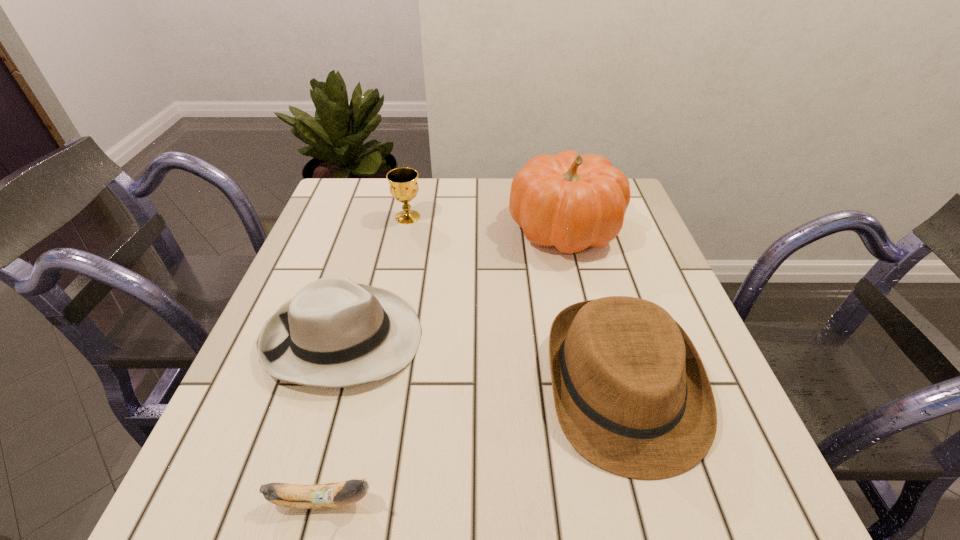
Where is `vacant space that is in between the left fedora and the shortest object`? The height and width of the screenshot is (540, 960). vacant space that is in between the left fedora and the shortest object is located at coordinates (333, 420).

Where is `empty space that is in between the left fedora and the chalice`? This screenshot has width=960, height=540. empty space that is in between the left fedora and the chalice is located at coordinates (375, 278).

You are a GUI agent. You are given a task and a screenshot of the screen. Output one action in this format:
    pyautogui.click(x=<x>, y=<y>)
    Task: Click on the vacant area between the nearest object and the left fedora
    The width and height of the screenshot is (960, 540).
    Given the screenshot: What is the action you would take?
    pyautogui.click(x=333, y=420)

Identify the location of object that ranks as the third closest to the left fedora. (632, 396).

Identify which object is the third closest to the right fedora. Please provide its 2D coordinates. Your answer should be formatted as a tuple, i.e. [(x, y)], where the tuple contains the x and y coordinates of a point satisfying the conditions above.

[(329, 495)]

Find the location of a particular element. This screenshot has height=540, width=960. vacant region that satisfies the following two spatial constraints: 1. on the front side of the pumpkin; 2. on the peel of the shortest object is located at coordinates (630, 501).

This screenshot has height=540, width=960. Identify the location of blank area in the image that satisfies the following two spatial constraints: 1. on the front side of the pumpkin; 2. on the peel of the nearest object. (630, 501).

Locate an element on the screen. This screenshot has width=960, height=540. vacant space that satisfies the following two spatial constraints: 1. on the front side of the tallest object; 2. on the peel of the shortest object is located at coordinates (630, 501).